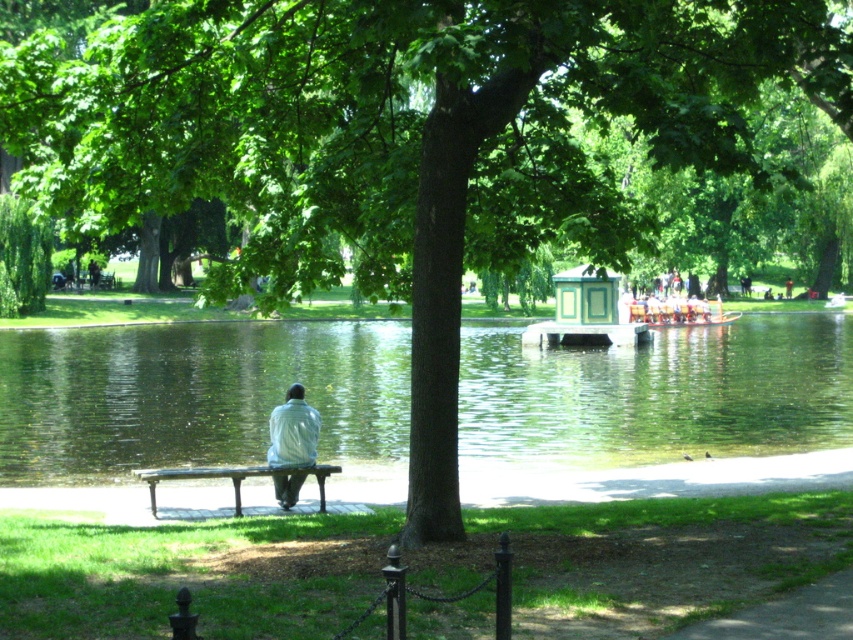
Question: Based on their relative distances, which object is farther from the green reflective water at center?

Choices:
 (A) wooden boat at center
 (B) wooden bench at lower center

Answer: (B)

Question: Among these points, which one is farthest from the camera?

Choices:
 (A) (309, 420)
 (B) (621, 301)
 (C) (244, 385)

Answer: (B)

Question: Can you confirm if light blue fabric at center is smaller than wooden boat at center?

Choices:
 (A) yes
 (B) no

Answer: (A)

Question: Is wooden bench at lower center below wooden boat at center?

Choices:
 (A) no
 (B) yes

Answer: (B)

Question: Is light blue fabric at center smaller than wooden boat at center?

Choices:
 (A) yes
 (B) no

Answer: (A)

Question: Which point is farther to the camera?

Choices:
 (A) light blue fabric at center
 (B) wooden bench at lower center
 (C) green reflective water at center
 (D) wooden boat at center

Answer: (D)